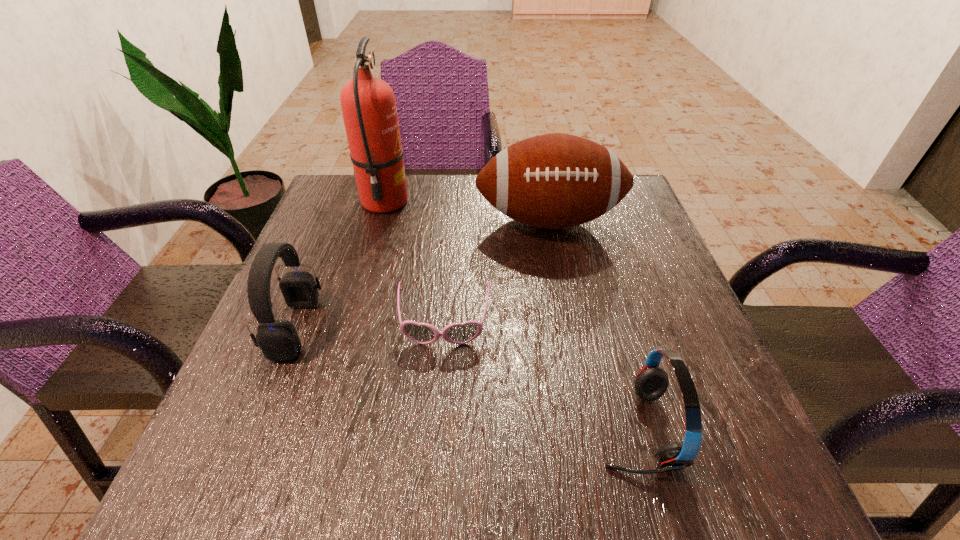
The height and width of the screenshot is (540, 960). I want to click on football at the right edge, so click(553, 181).

This screenshot has width=960, height=540. Find the location of `headset present at the right edge`. headset present at the right edge is located at coordinates (651, 382).

Where is `object positioned at the far left corner`? Image resolution: width=960 pixels, height=540 pixels. object positioned at the far left corner is located at coordinates (368, 104).

This screenshot has height=540, width=960. What are the coordinates of `object situated at the far right corner` in the screenshot? It's located at (553, 181).

Find the location of a particular element. object that is at the near right corner is located at coordinates (651, 382).

I want to click on vacant space at the far edge, so click(x=418, y=219).

Where is `free space at the near edge of the desktop`? The image size is (960, 540). free space at the near edge of the desktop is located at coordinates (498, 485).

Locate an element on the screen. The image size is (960, 540). vacant space at the left edge of the desktop is located at coordinates (223, 432).

Where is `vacant space at the right edge of the desktop`? vacant space at the right edge of the desktop is located at coordinates (668, 272).

Locate an element on the screen. The width and height of the screenshot is (960, 540). free space at the far left corner of the desktop is located at coordinates (325, 209).